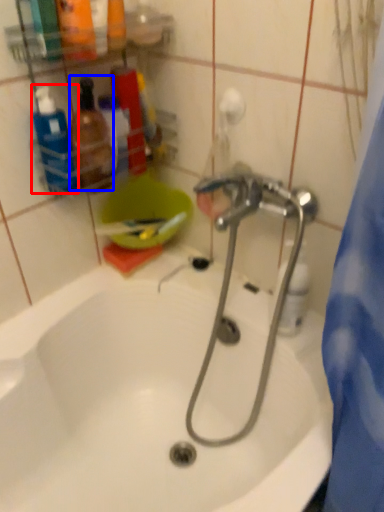
Question: Which point is further to the camera, cleaning product (highlighted by a red box) or toiletry (highlighted by a blue box)?

Choices:
 (A) cleaning product
 (B) toiletry

Answer: (B)